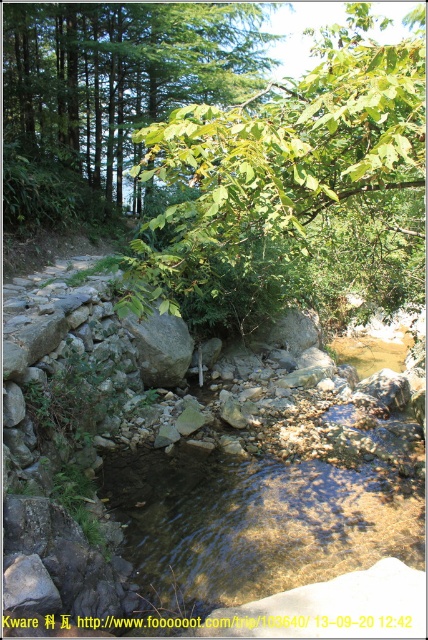
You are a hiker who wants to cross the clear water at center to reach the green leafy tree at upper center. The distance between them is 36.95 feet. If your hiking boots have a maximum wading depth of 3 feet, can you safely cross the stream? Assume the water depth is consistent across the stream.

The clear water at center is 36.95 feet away from the green leafy tree at upper center. Since the water depth is consistent and your boots can handle up to 3 feet, you can safely cross the stream as long as the depth doesn not exceed 3 feet. However, the question doesn not provide the actual water depth, so we cannot confirm safety based on the given information.

You are standing at the origin point in the image. Where is the green leafy tree at center located?

The green leafy tree at center is located at point (275, 172).

You are a hiker who wants to take a photo of the green leafy tree at center and the clear water at center. Which object should you focus on first if you want to capture both in one frame without moving the camera?

The green leafy tree at center is larger in size than the clear water at center, so you should focus on the green leafy tree at center first to ensure it fills the frame appropriately before adjusting for the smaller clear water at center.